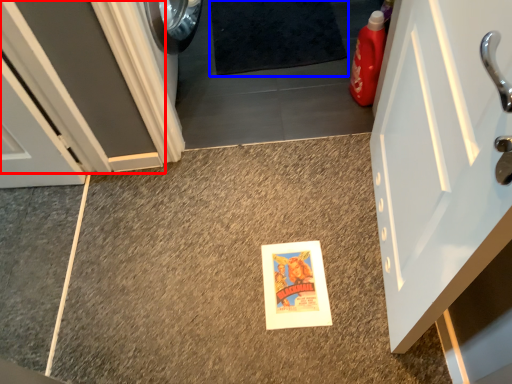
Question: Which of the following is the closest to the observer, door (highlighted by a red box) or bath mat (highlighted by a blue box)?

Choices:
 (A) door
 (B) bath mat

Answer: (A)